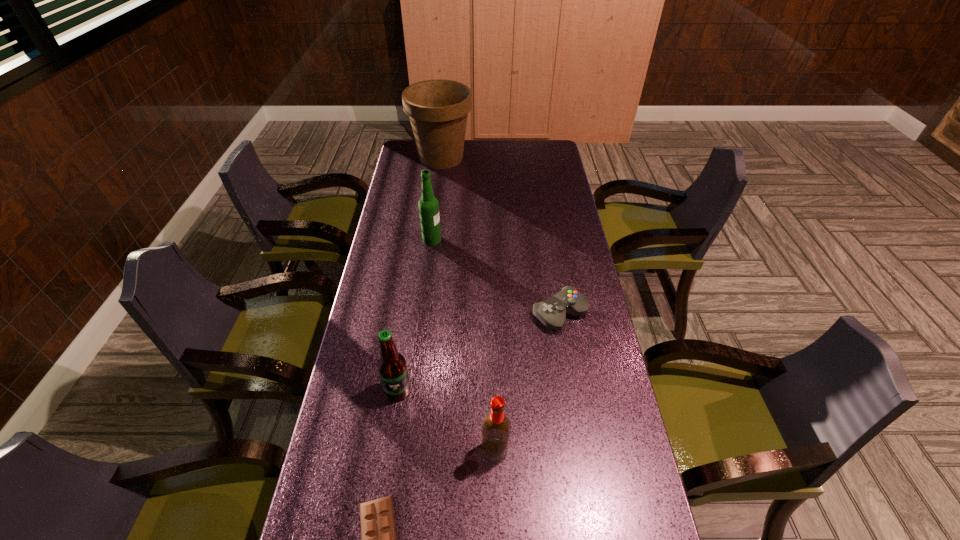
At what (x,y) coordinates should I click in order to perform the action: click on beer bottle identified as the third closest to the shortest object. Please return your answer as a coordinate pair (x, y). The width and height of the screenshot is (960, 540). Looking at the image, I should click on (428, 205).

Find the location of a particular element. vacant position in the image that satisfies the following two spatial constraints: 1. on the label of the second farthest object; 2. on the label of the fourth farthest object is located at coordinates (414, 390).

Where is `vacant space that satisfies the following two spatial constraints: 1. on the front side of the rightmost beer bottle; 2. on the right side of the flowerpot`? The height and width of the screenshot is (540, 960). vacant space that satisfies the following two spatial constraints: 1. on the front side of the rightmost beer bottle; 2. on the right side of the flowerpot is located at coordinates (406, 450).

Where is `vacant space that satisfies the following two spatial constraints: 1. on the label of the tallest beer bottle; 2. on the label of the second farthest beer bottle`? vacant space that satisfies the following two spatial constraints: 1. on the label of the tallest beer bottle; 2. on the label of the second farthest beer bottle is located at coordinates (414, 390).